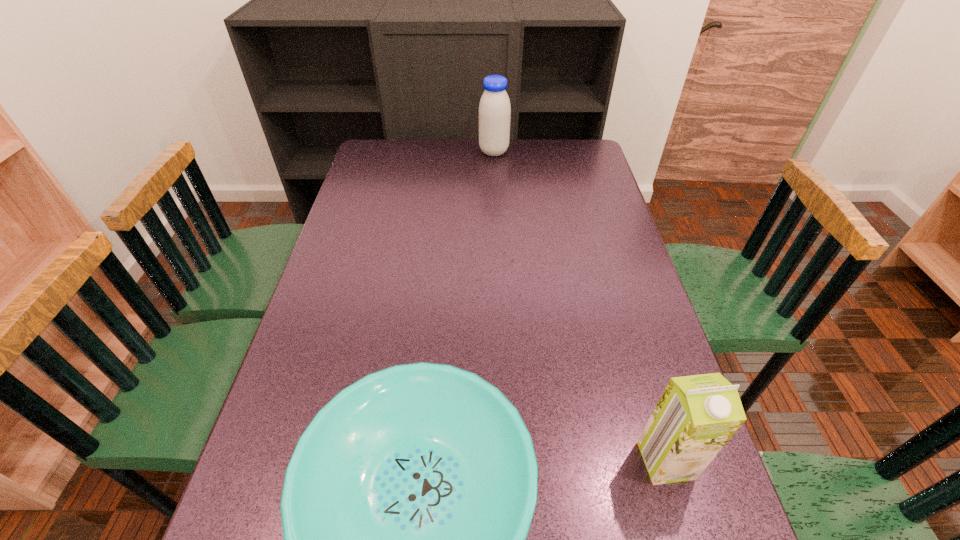
Locate an element on the screen. free space at the far left corner is located at coordinates (365, 154).

Locate an element on the screen. This screenshot has height=540, width=960. free spot between the right soya milk and the farthest object is located at coordinates (580, 306).

Identify the location of the second closest object relative to the shortest object. This screenshot has height=540, width=960. (494, 109).

Select which object is the second closest to the right soya milk. Please provide its 2D coordinates. Your answer should be formatted as a tuple, i.e. [(x, y)], where the tuple contains the x and y coordinates of a point satisfying the conditions above.

[(494, 109)]